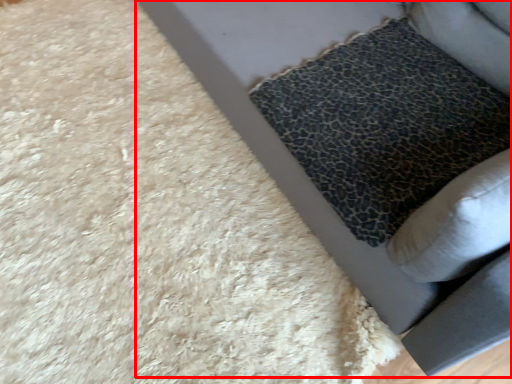
Question: Observing the image, what is the correct spatial positioning of furniture (annotated by the red box) in reference to pillow?

Choices:
 (A) left
 (B) right

Answer: (A)